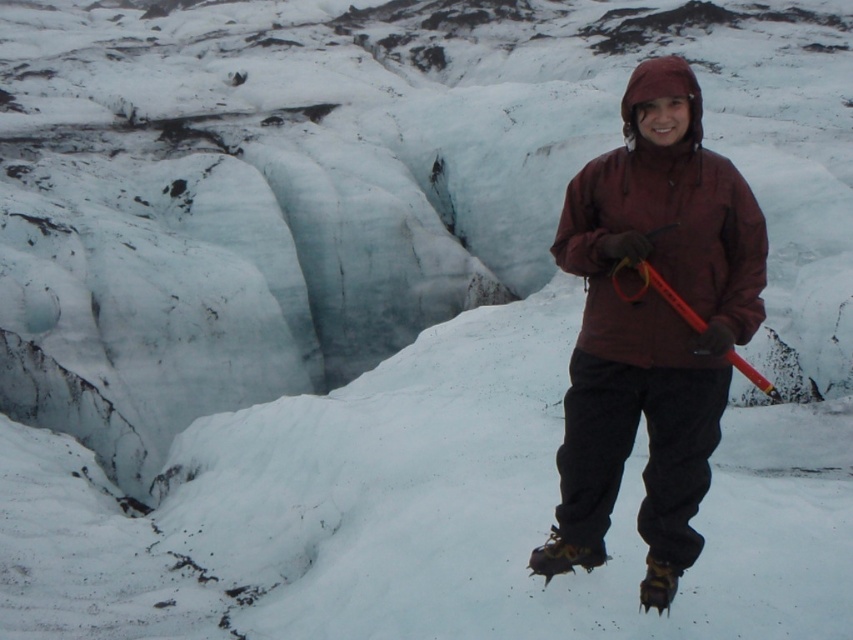
Based on the photo, you are a hiker planning to cross a glacier. You have a maroon fleece jacket at center and an orange plastic ski pole at center. Which item is closer to you as you face the glacier?

The maroon fleece jacket at center is closer to you because the orange plastic ski pole at center is behind it.

You are a hiker planning to cross a glacier and have both a maroon fleece jacket at center and an orange plastic ski pole at center. Which item should you grab first if you need to reach the one on the left?

The orange plastic ski pole at center is on the left side of the maroon fleece jacket at center, so you should grab the orange plastic ski pole at center first.

You are a photographer planning to take a photo of the maroon fleece jacket at center and the orange plastic ski pole at center. If your camera has a limited field of view, which object should you focus on to ensure both are in the frame without zooming out?

The maroon fleece jacket at center is wider than the orange plastic ski pole at center, so focusing on the maroon fleece jacket at center would ensure both are in the frame without needing to zoom out.